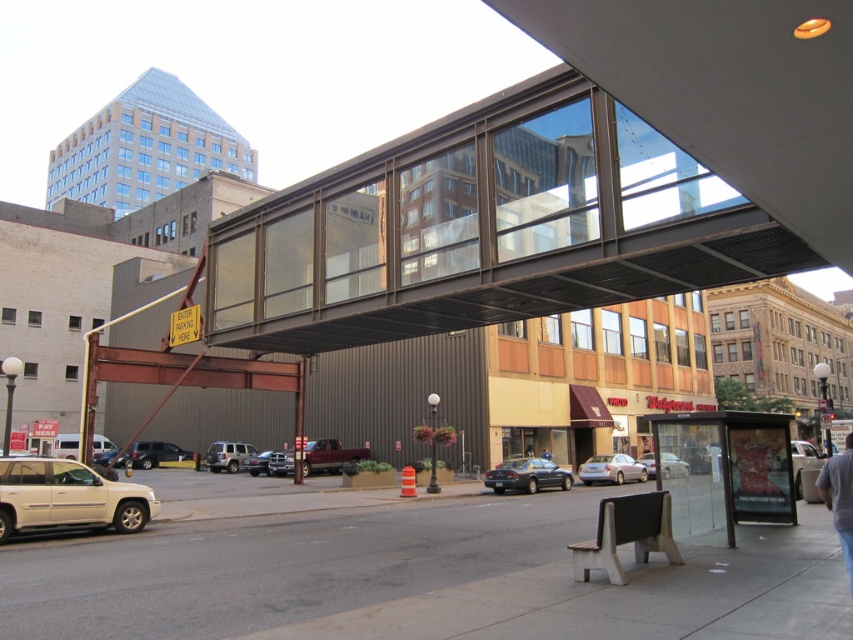
You are a delivery person trying to navigate through the urban street scene. You need to move a large pallet that is 2 meters wide. Can you fit the pallet through the space between the gray concrete sidewalk at lower center and the transparent glass bus stop at lower right?

The gray concrete sidewalk at lower center is wider than the transparent glass bus stop at lower right. Since the pallet is 2 meters wide, you need to check the minimum width between them. However, the exact width isn not provided, so it might not be possible to determine without more information.

You are standing at the pedestrian overpass and want to locate two points marked on the street below. The first point is at coordinates point (x=676, y=531) and the second is at point (x=639, y=460). Which of these points is closer to you?

Point (x=676, y=531) is closer to the viewer than point (x=639, y=460).

You are a delivery person trying to reach the transparent glass bus stop at lower right to drop off a package. However, there is a silver metallic sedan at center blocking the path. Can you still access the bus stop without moving the car?

The transparent glass bus stop at lower right is positioned over the silver metallic sedan at center, meaning the bus stop is elevated above the street level where the sedan is parked. Since the bus stop is above the sedan, you can still access it without moving the car.